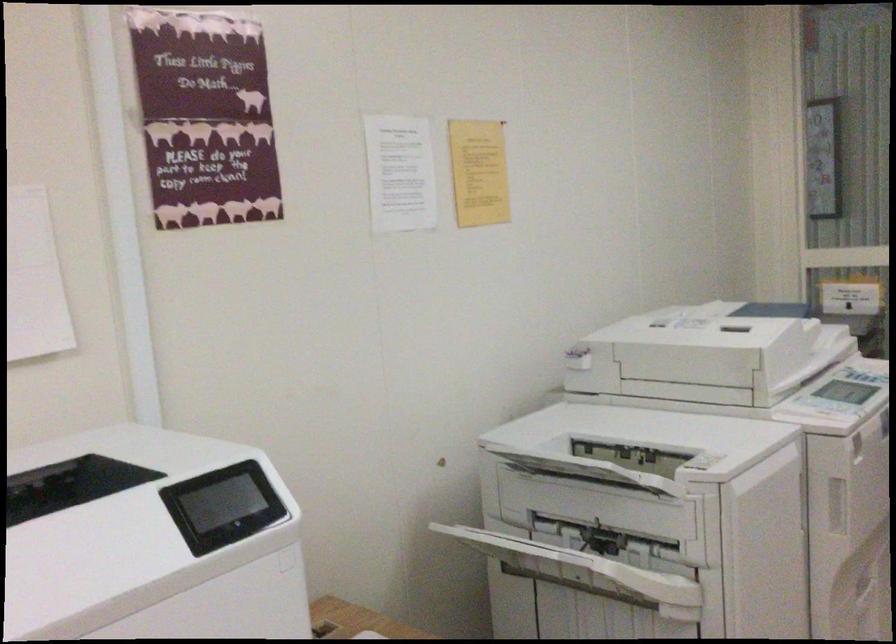
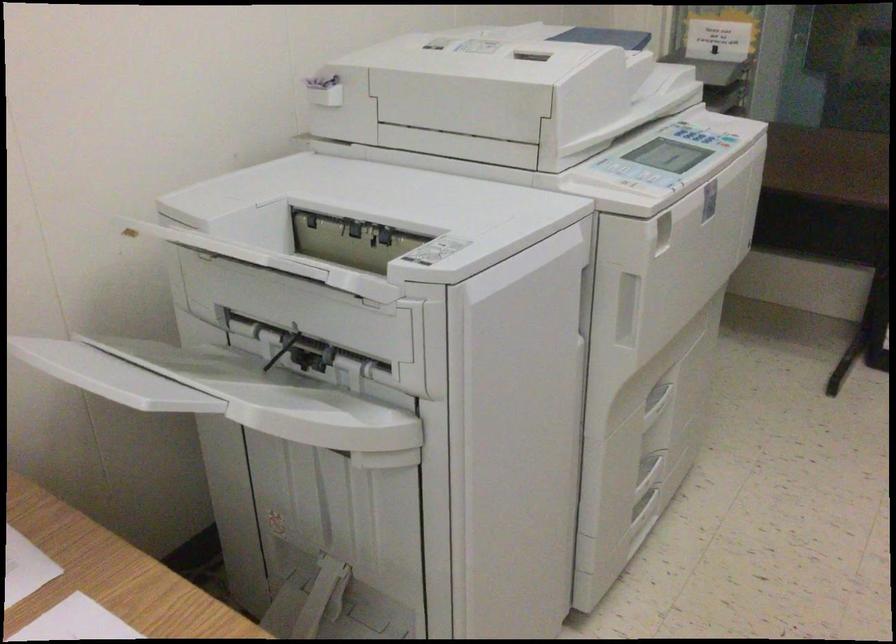
The point at [703,467] is marked in the first image. Where is the corresponding point in the second image?

(435, 251)